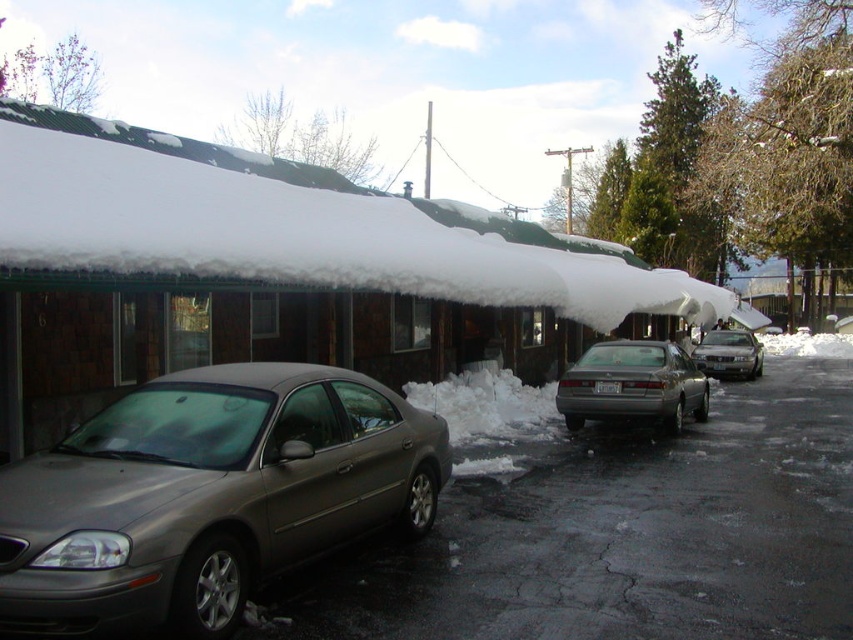
Which is above, satin metallic sedan at center or silver metallic sedan at right?

satin metallic sedan at center is above.

Measure the distance between satin metallic sedan at center and silver metallic sedan at right.

A distance of 20.41 meters exists between satin metallic sedan at center and silver metallic sedan at right.

Is point (181, 588) less distant than point (741, 330)?

Yes, point (181, 588) is in front of point (741, 330).

I want to click on satin metallic sedan at center, so click(207, 496).

Does white fluffy snow at upper left appear on the right side of silver metallic sedan at right?

No, white fluffy snow at upper left is not to the right of silver metallic sedan at right.

Between white fluffy snow at upper left and silver metallic sedan at right, which one has more height?

Standing taller between the two is white fluffy snow at upper left.

Is point (491, 282) farther from viewer compared to point (741, 348)?

That is False.

I want to click on white fluffy snow at upper left, so coord(289,227).

Is point (181, 420) behind point (608, 360)?

That is False.

Between point (164, 570) and point (641, 342), which one is positioned in front?

Point (164, 570)

Is point (241, 416) positioned in front of point (704, 392)?

Yes, point (241, 416) is closer to viewer.

Where is `satin metallic sedan at center`? The image size is (853, 640). satin metallic sedan at center is located at coordinates (207, 496).